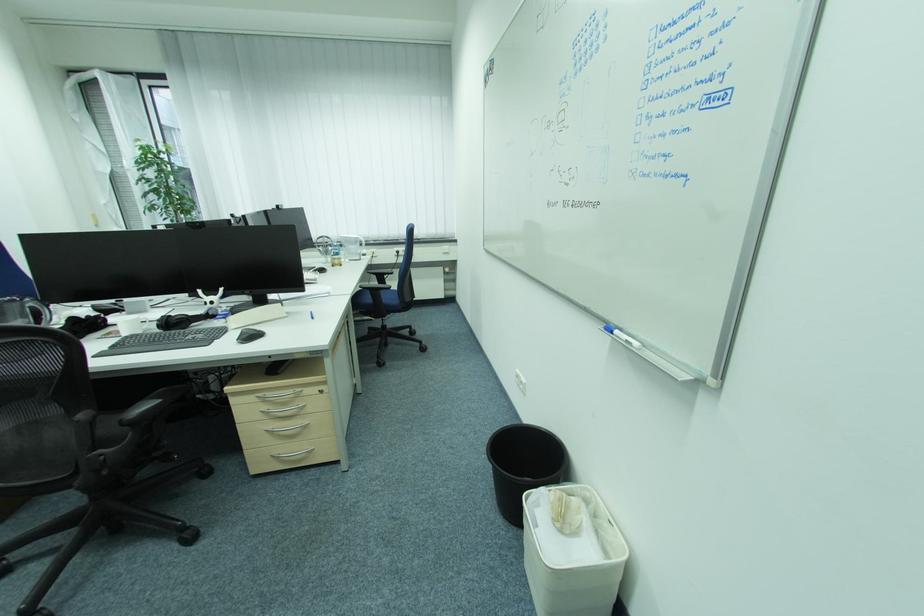
Where would you lift the black headphones? Please return your answer as a coordinate pair (x, y).

(184, 320)